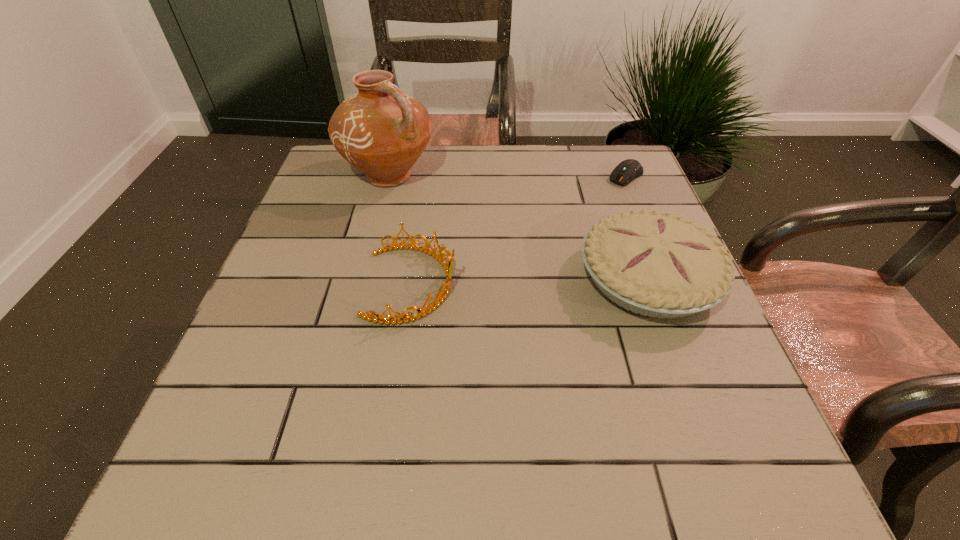
I want to click on vacant space located on the side of the pottery with the handle, so click(444, 219).

Where is `vacant space located 0.270m on the side of the pottery with the handle`? vacant space located 0.270m on the side of the pottery with the handle is located at coordinates (486, 251).

This screenshot has width=960, height=540. Identify the location of computer equipment that is at the far edge. (626, 171).

Where is `pottery that is at the far edge`? The image size is (960, 540). pottery that is at the far edge is located at coordinates (382, 131).

The width and height of the screenshot is (960, 540). What are the coordinates of `object located in the left edge section of the desktop` in the screenshot? It's located at (382, 131).

The height and width of the screenshot is (540, 960). In order to click on pie at the right edge in this screenshot , I will do `click(654, 264)`.

Find the location of a particular element. This screenshot has width=960, height=540. computer equipment situated at the right edge is located at coordinates (626, 171).

Identify the location of object at the far left corner. This screenshot has height=540, width=960. (382, 131).

What are the coordinates of `object situated at the far right corner` in the screenshot? It's located at (626, 171).

The width and height of the screenshot is (960, 540). In the image, there is a desktop. What are the coordinates of `vacant space at the far edge` in the screenshot? It's located at (521, 188).